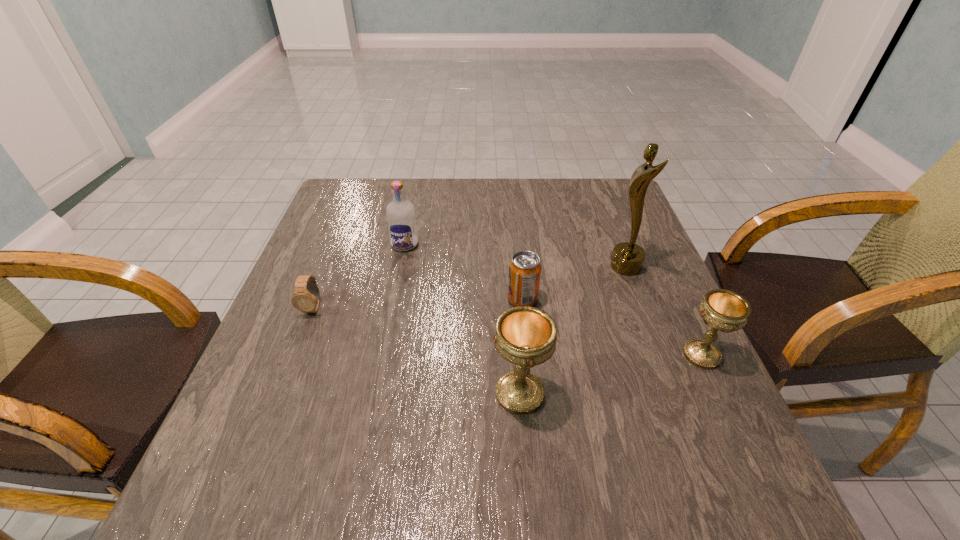
You are a GUI agent. You are given a task and a screenshot of the screen. Output one action in this format:
    pyautogui.click(x=<x>, y=<y>)
    Task: Click on the free point that keeps the chalices evenly spaced on the left
    
    Given the screenshot: What is the action you would take?
    pyautogui.click(x=306, y=439)